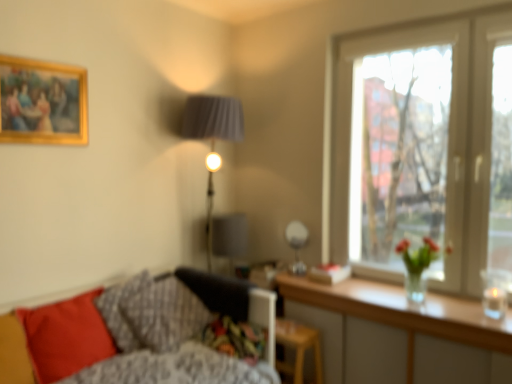
Locate an element on the screen. vacant space positioned to the left of translucent glass candle at lower right is located at coordinates (461, 314).